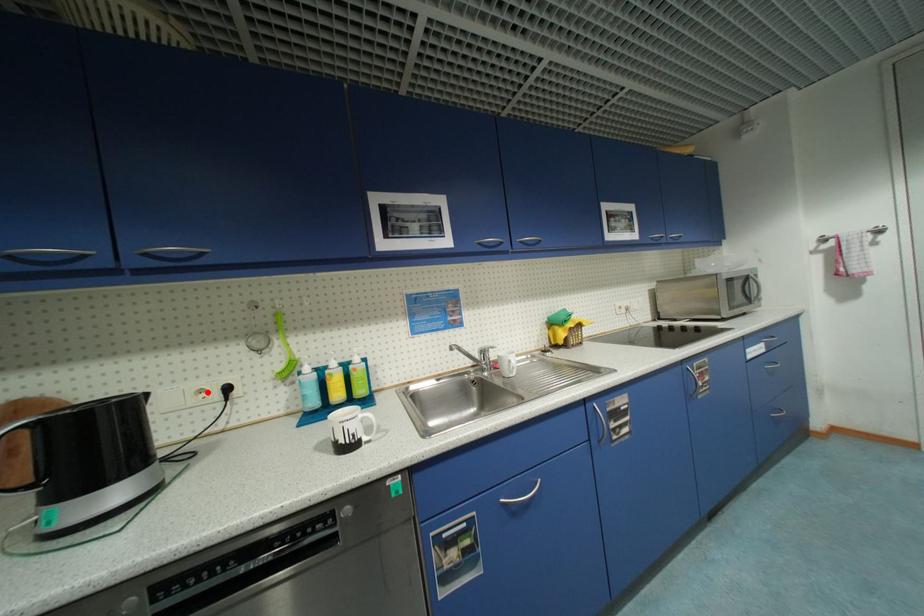
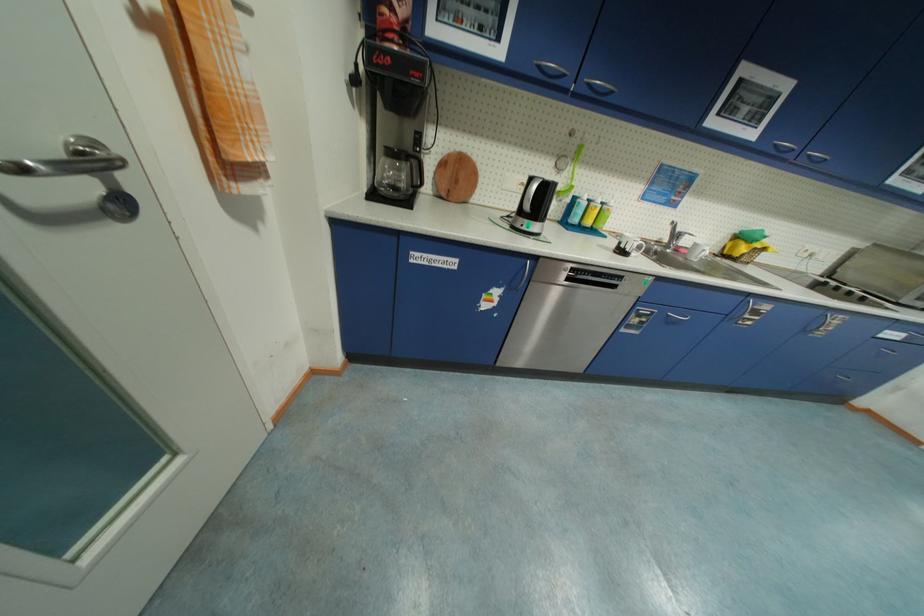
Question: I am providing you with two images of the same scene from different viewpoints. Given a red point in image1, look at the same physical point in image2. Is it:

Choices:
 (A) Closer to the viewpoint
 (B) Farther from the viewpoint

Answer: (A)